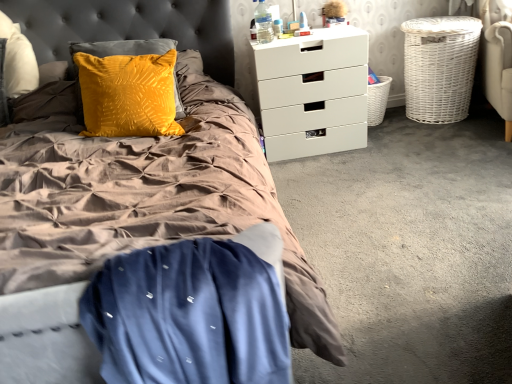
This screenshot has width=512, height=384. What are the coordinates of `free space in front of white wicker basket at lower right, which ranks as the second basket in right-to-left order` in the screenshot? It's located at (390, 131).